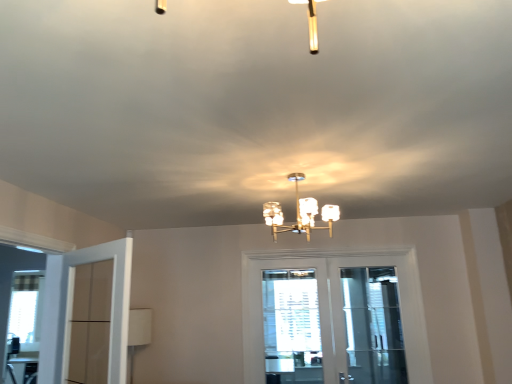
Question: Is white glossy door at center, the first door in the back-to-front sequence, at the right side of clear glass screen door at center?

Choices:
 (A) no
 (B) yes

Answer: (A)

Question: Considering the relative sizes of white glossy door at center, which ranks as the first door in right-to-left order, and clear glass screen door at center in the image provided, is white glossy door at center, which ranks as the first door in right-to-left order, taller than clear glass screen door at center?

Choices:
 (A) no
 (B) yes

Answer: (B)

Question: Is white glossy door at center, which ranks as the first door in right-to-left order, turned away from clear glass screen door at center?

Choices:
 (A) yes
 (B) no

Answer: (A)

Question: Considering the relative sizes of white glossy door at center, the 2th door from the front, and clear glass screen door at center in the image provided, is white glossy door at center, the 2th door from the front, shorter than clear glass screen door at center?

Choices:
 (A) no
 (B) yes

Answer: (A)

Question: Does white glossy door at center, the 2th door from the front, appear on the left side of clear glass screen door at center?

Choices:
 (A) no
 (B) yes

Answer: (B)

Question: Can you confirm if white glossy door at center, which is counted as the 2th door, starting from the left, is wider than clear glass screen door at center?

Choices:
 (A) no
 (B) yes

Answer: (B)

Question: Is white textured window at center smaller than matte glass chandelier at center?

Choices:
 (A) no
 (B) yes

Answer: (B)

Question: Considering the relative sizes of white textured window at center and matte glass chandelier at center in the image provided, is white textured window at center wider than matte glass chandelier at center?

Choices:
 (A) no
 (B) yes

Answer: (A)

Question: Can you confirm if white textured window at center is bigger than matte glass chandelier at center?

Choices:
 (A) yes
 (B) no

Answer: (B)

Question: Is white textured window at center shorter than matte glass chandelier at center?

Choices:
 (A) yes
 (B) no

Answer: (B)

Question: Can you confirm if white textured window at center is positioned to the left of matte glass chandelier at center?

Choices:
 (A) yes
 (B) no

Answer: (B)

Question: Can we say white textured window at center lies outside matte glass chandelier at center?

Choices:
 (A) yes
 (B) no

Answer: (A)

Question: Can you confirm if matte glass chandelier at center is positioned to the left of clear glass screen door at center?

Choices:
 (A) yes
 (B) no

Answer: (A)